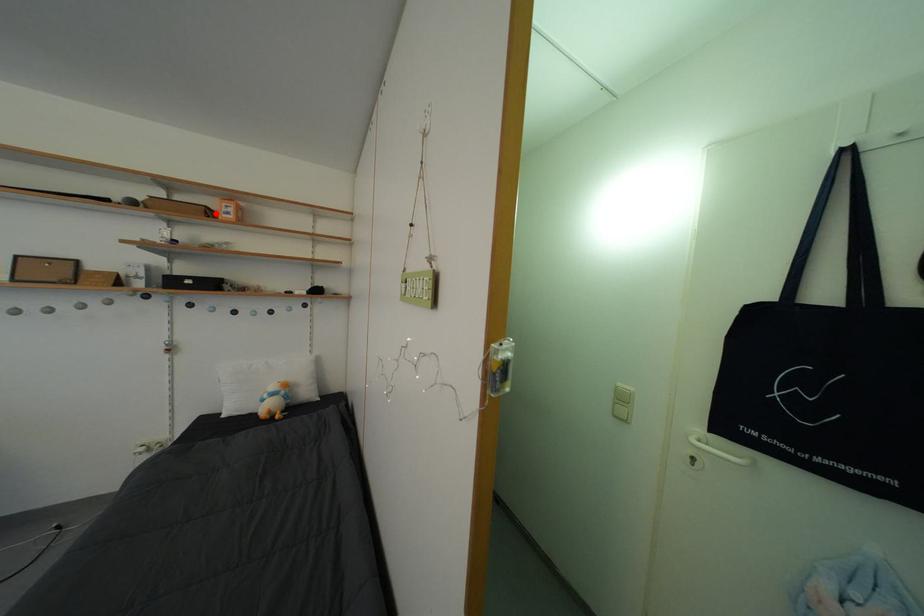
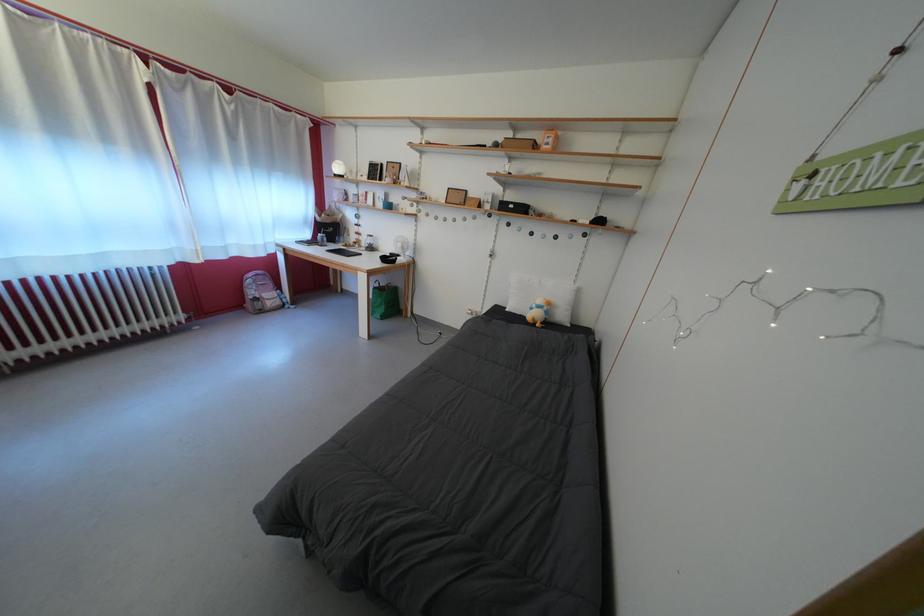
Find the pixel in the second image that matches the highlighted location in the first image.

(543, 147)